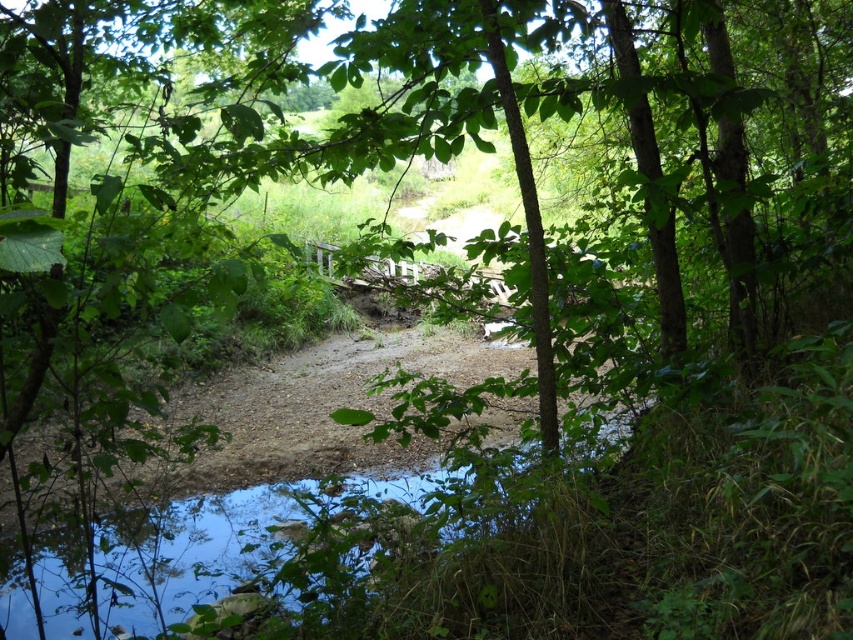
Which is more to the left, brown gravel dirt track at center or clear water at bottom?

brown gravel dirt track at center is more to the left.

Is brown gravel dirt track at center smaller than clear water at bottom?

Actually, brown gravel dirt track at center might be larger than clear water at bottom.

Identify the location of brown gravel dirt track at center. (315, 410).

This screenshot has height=640, width=853. Find the location of `brown gravel dirt track at center`. brown gravel dirt track at center is located at coordinates (315, 410).